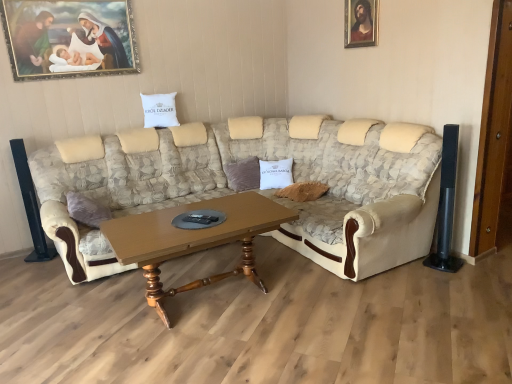
Identify the location of empty space that is ontop of brown wooden coffee table at center (from a real-world perspective). Image resolution: width=512 pixels, height=384 pixels. (215, 228).